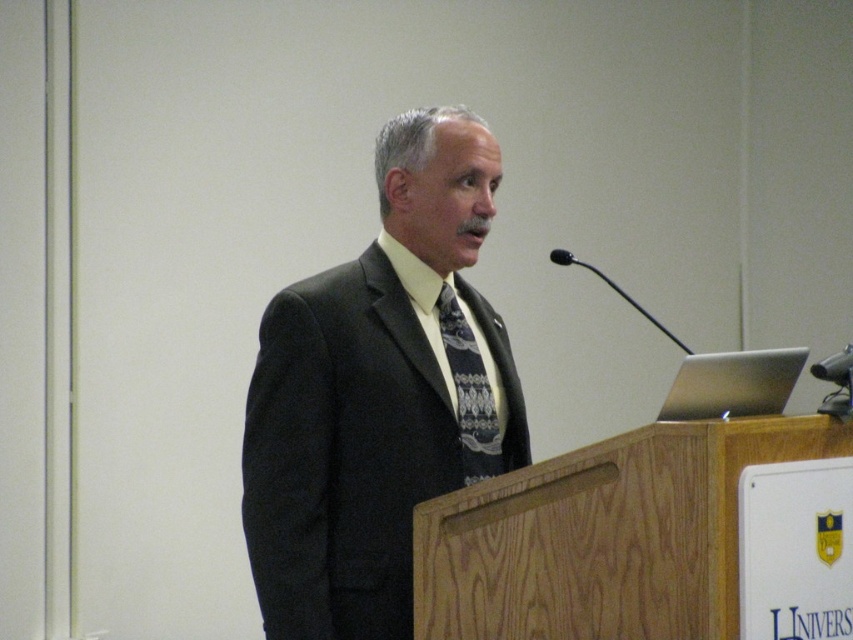
Question: Is dark gray suit at center positioned at the back of dark blue textured tie at center?

Choices:
 (A) yes
 (B) no

Answer: (B)

Question: Is dark gray suit at center bigger than dark blue textured tie at center?

Choices:
 (A) no
 (B) yes

Answer: (B)

Question: Which object appears closest to the camera in this image?

Choices:
 (A) dark blue textured tie at center
 (B) dark gray suit at center

Answer: (B)

Question: Does dark gray suit at center appear over dark blue textured tie at center?

Choices:
 (A) yes
 (B) no

Answer: (A)